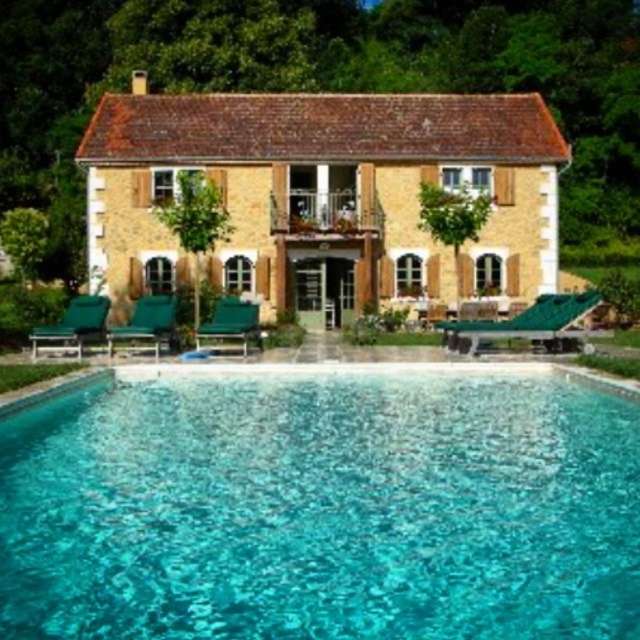
Question: Does green fabric chair at lower left appear on the left side of green fabric chair at center?

Choices:
 (A) yes
 (B) no

Answer: (A)

Question: Estimate the real-world distances between objects in this image. Which object is closer to the green plastic chair at center?

Choices:
 (A) green fabric chair at center
 (B) green fabric lounge chair at lower left

Answer: (B)

Question: Does green fabric lounge chair at lower left appear under green plastic chair at center?

Choices:
 (A) yes
 (B) no

Answer: (B)

Question: Considering the real-world distances, which object is closest to the clear glass water at lower center?

Choices:
 (A) green fabric chair at center
 (B) green plastic chair at center

Answer: (B)

Question: Is clear glass water at lower center thinner than green fabric lounge chair at lower left?

Choices:
 (A) no
 (B) yes

Answer: (A)

Question: Among these points, which one is nearest to the camera?

Choices:
 (A) (246, 323)
 (B) (156, 340)

Answer: (B)